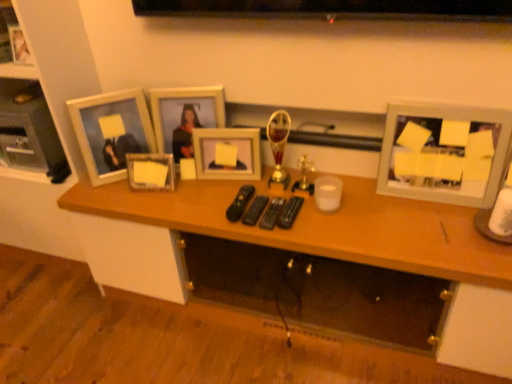
I want to click on free space in front of wooden photo frame at center, the 3th picture frame in the right-to-left sequence, so click(x=186, y=195).